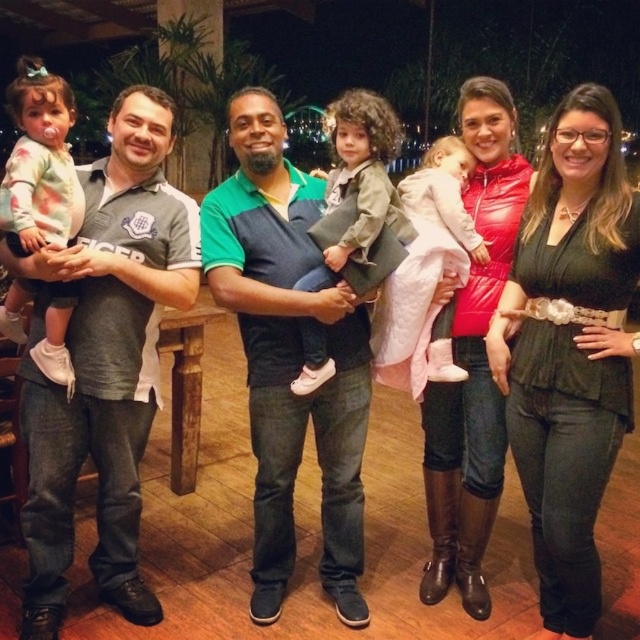
You are a photographer setting up for a family portrait. You notice two jackets hanging on a rack in the background. The matte red jacket at center and the matte green jacket at center. Which jacket is positioned lower on the rack?

The matte red jacket at center is located below the matte green jacket at center, so it is positioned lower on the rack.

You are a photographer adjusting your camera settings for a family portrait. The subject wearing the green textured blouse at center is 6.44 feet away from the camera. If your camera has a focal length of 50mm and you want to ensure the subject fills the frame adequately, what adjustment should you make to your camera position?

To ensure the subject wearing the green textured blouse at center fills the frame adequately at a distance of 6.44 feet with a 50mm lens, you should move closer to the subject or use a lens with a longer focal length.